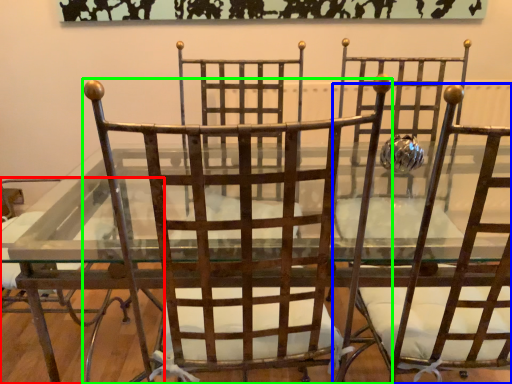
Question: Which is farther away from chair (highlighted by a red box)? chair (highlighted by a blue box) or chair (highlighted by a green box)?

Choices:
 (A) chair
 (B) chair

Answer: (A)